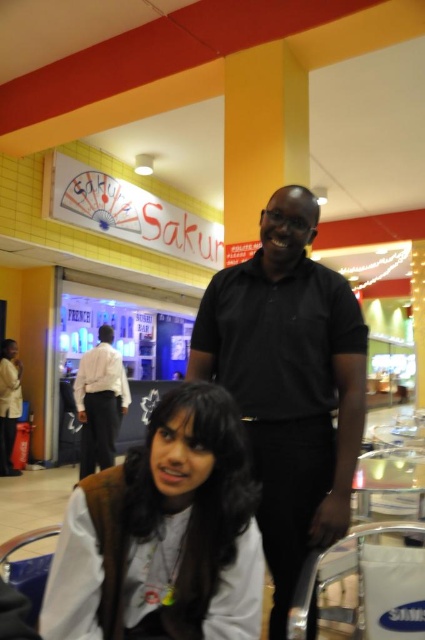
Question: Among these objects, which one is nearest to the camera?

Choices:
 (A) white shirt at center
 (B) black matte shirt at center

Answer: (B)

Question: Does black matte shirt at center lie in front of white shirt at center?

Choices:
 (A) yes
 (B) no

Answer: (A)

Question: Is black matte shirt at center above white shirt at center?

Choices:
 (A) no
 (B) yes

Answer: (B)

Question: Which object appears farthest from the camera in this image?

Choices:
 (A) white matte vest at lower center
 (B) white shirt at center
 (C) black matte shirt at center

Answer: (B)

Question: Considering the real-world distances, which object is closest to the white shirt at center?

Choices:
 (A) white shirt at lower left
 (B) black matte shirt at center

Answer: (A)

Question: Does white matte vest at lower center appear over white shirt at center?

Choices:
 (A) no
 (B) yes

Answer: (B)